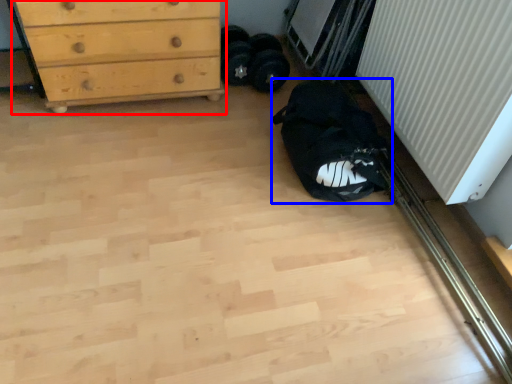
Question: Which point is closer to the camera, chest of drawers (highlighted by a red box) or sleeping bag (highlighted by a blue box)?

Choices:
 (A) chest of drawers
 (B) sleeping bag

Answer: (B)